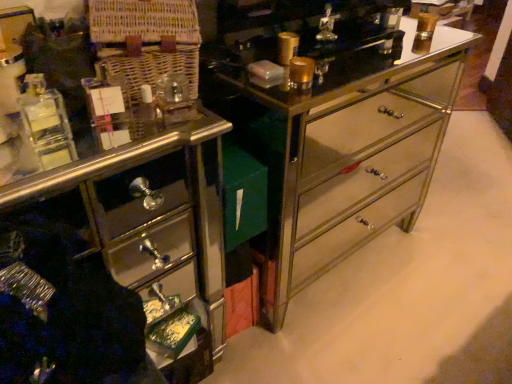
What are the coordinates of `vacant region to the right of metallic mirrored dresser at center` in the screenshot? It's located at (453, 252).